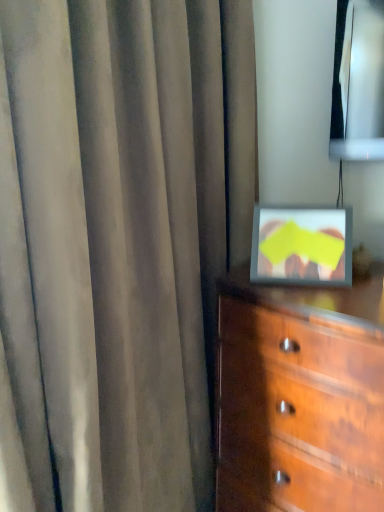
Question: Is point (365, 501) positioned closer to the camera than point (140, 162)?

Choices:
 (A) closer
 (B) farther

Answer: (A)

Question: From the image's perspective, is wooden chest of drawers at lower right positioned above or below satin gray curtain at center?

Choices:
 (A) below
 (B) above

Answer: (A)

Question: Is wooden chest of drawers at lower right to the left or to the right of satin gray curtain at center in the image?

Choices:
 (A) right
 (B) left

Answer: (A)

Question: Looking at their shapes, would you say satin gray curtain at center is wider or thinner than wooden chest of drawers at lower right?

Choices:
 (A) wide
 (B) thin

Answer: (B)

Question: Is satin gray curtain at center bigger or smaller than wooden chest of drawers at lower right?

Choices:
 (A) big
 (B) small

Answer: (A)

Question: From a real-world perspective, relative to wooden chest of drawers at lower right, is satin gray curtain at center vertically above or below?

Choices:
 (A) below
 (B) above

Answer: (B)

Question: Choose the correct answer: Is satin gray curtain at center inside wooden chest of drawers at lower right or outside it?

Choices:
 (A) inside
 (B) outside

Answer: (B)